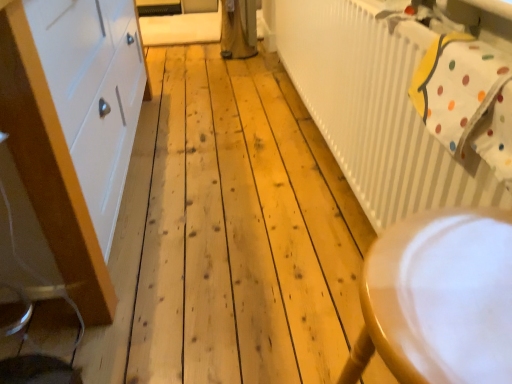
Question: From the image's perspective, is white painted wood cabinet at left located above or below white polka dot fabric at upper right?

Choices:
 (A) below
 (B) above

Answer: (B)

Question: Does point (50, 157) appear closer or farther from the camera than point (482, 77)?

Choices:
 (A) closer
 (B) farther

Answer: (B)

Question: Estimate the real-world distances between objects in this image. Which object is closer to the wooden chair at lower right?

Choices:
 (A) white painted wood cabinet at left
 (B) white polka dot fabric at upper right
 (C) white ribbed radiator at upper right

Answer: (B)

Question: Considering the real-world distances, which object is closest to the white ribbed radiator at upper right?

Choices:
 (A) white polka dot fabric at upper right
 (B) white painted wood cabinet at left
 (C) wooden chair at lower right

Answer: (A)